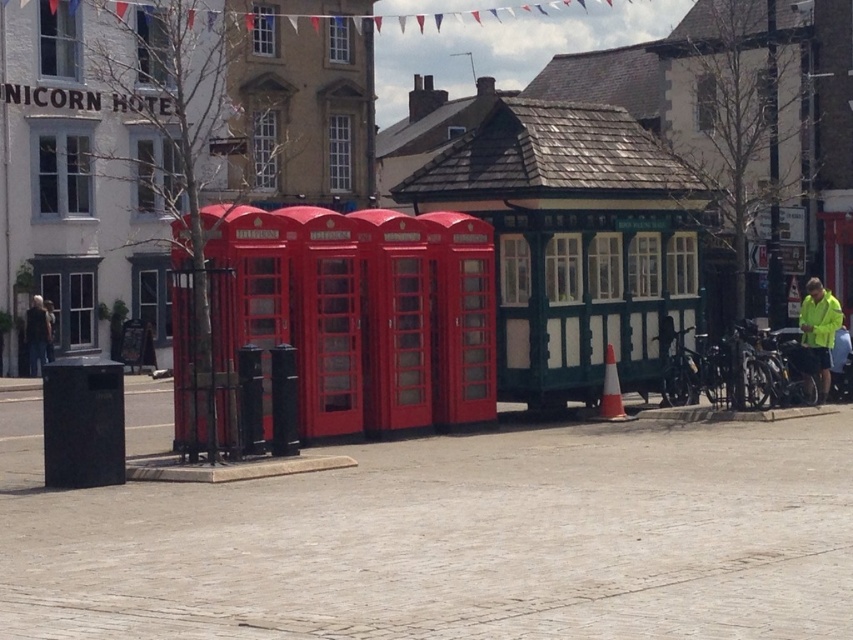
How much distance is there between neon yellow jacket at right and dark gray jacket at left?

They are 18.87 meters apart.

Is neon yellow jacket at right behind dark gray jacket at left?

No, neon yellow jacket at right is closer to the viewer.

This screenshot has height=640, width=853. What are the coordinates of `neon yellow jacket at right` in the screenshot? It's located at (817, 336).